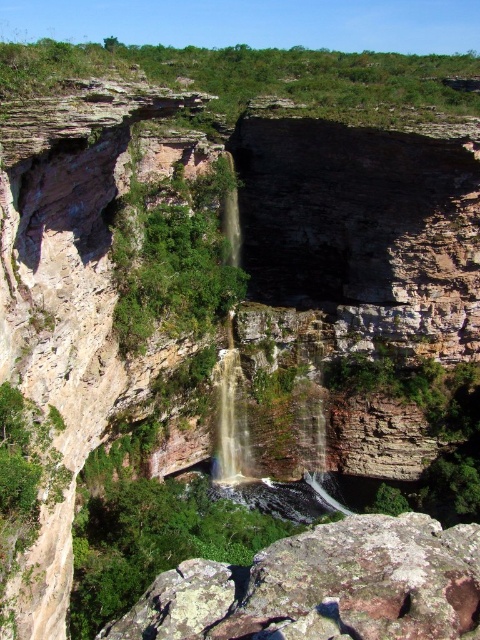
Does rusty rock at center have a greater height compared to smooth rock waterfall at center?

Incorrect, rusty rock at center's height is not larger of smooth rock waterfall at center's.

Which is in front, point (462, 572) or point (240, 257)?

Point (462, 572) is in front.

This screenshot has width=480, height=640. I want to click on rusty rock at center, so click(x=324, y=588).

Where is `rusty rock at center`? rusty rock at center is located at coordinates (324, 588).